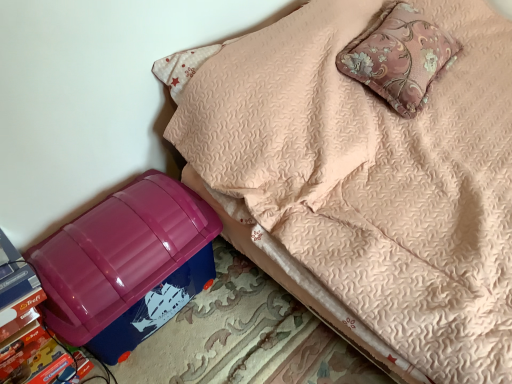
Question: Considering the relative sizes of pink floral cushion at upper right and glossy plastic storage box at lower left in the image provided, is pink floral cushion at upper right taller than glossy plastic storage box at lower left?

Choices:
 (A) yes
 (B) no

Answer: (B)

Question: Can you confirm if pink floral cushion at upper right is shorter than glossy plastic storage box at lower left?

Choices:
 (A) no
 (B) yes

Answer: (B)

Question: From the image's perspective, is pink floral cushion at upper right on top of glossy plastic storage box at lower left?

Choices:
 (A) no
 (B) yes

Answer: (B)

Question: Are pink floral cushion at upper right and glossy plastic storage box at lower left beside each other?

Choices:
 (A) yes
 (B) no

Answer: (B)

Question: Is pink floral cushion at upper right to the left of glossy plastic storage box at lower left from the viewer's perspective?

Choices:
 (A) no
 (B) yes

Answer: (A)

Question: Is pink floral cushion at upper right looking in the opposite direction of glossy plastic storage box at lower left?

Choices:
 (A) no
 (B) yes

Answer: (A)

Question: Does glossy plastic storage box at lower left have a lesser height compared to blue plastic storage bin at lower left?

Choices:
 (A) no
 (B) yes

Answer: (B)

Question: Does glossy plastic storage box at lower left appear on the right side of blue plastic storage bin at lower left?

Choices:
 (A) no
 (B) yes

Answer: (A)

Question: From a real-world perspective, is glossy plastic storage box at lower left on blue plastic storage bin at lower left?

Choices:
 (A) yes
 (B) no

Answer: (B)

Question: Can you confirm if glossy plastic storage box at lower left is thinner than blue plastic storage bin at lower left?

Choices:
 (A) no
 (B) yes

Answer: (B)

Question: Is blue plastic storage bin at lower left located within glossy plastic storage box at lower left?

Choices:
 (A) yes
 (B) no

Answer: (B)

Question: Is glossy plastic storage box at lower left smaller than blue plastic storage bin at lower left?

Choices:
 (A) yes
 (B) no

Answer: (A)

Question: Is blue plastic storage bin at lower left with pink floral cushion at upper right?

Choices:
 (A) yes
 (B) no

Answer: (B)